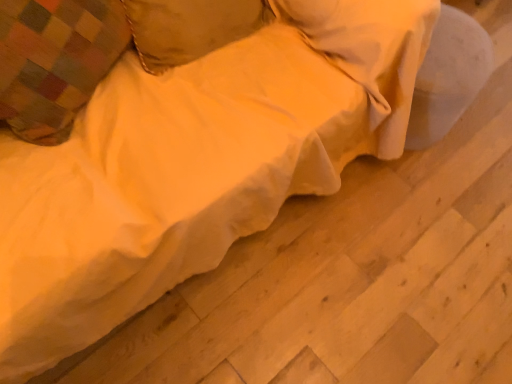
Question: Can you confirm if soft yellow fabric pillow at upper center, arranged as the first pillow when viewed from the right, is positioned to the left of plaid fabric pillow at upper left, placed as the first pillow when sorted from left to right?

Choices:
 (A) yes
 (B) no

Answer: (B)

Question: From the image's perspective, is soft yellow fabric pillow at upper center, arranged as the first pillow when viewed from the right, located beneath plaid fabric pillow at upper left, the 2th pillow when ordered from right to left?

Choices:
 (A) no
 (B) yes

Answer: (A)

Question: Considering the relative positions of soft yellow fabric pillow at upper center, the second pillow positioned from the left, and plaid fabric pillow at upper left, placed as the first pillow when sorted from left to right, in the image provided, is soft yellow fabric pillow at upper center, the second pillow positioned from the left, behind plaid fabric pillow at upper left, placed as the first pillow when sorted from left to right,?

Choices:
 (A) no
 (B) yes

Answer: (B)

Question: Can you confirm if soft yellow fabric pillow at upper center, the second pillow positioned from the left, is positioned to the right of plaid fabric pillow at upper left, placed as the first pillow when sorted from left to right?

Choices:
 (A) no
 (B) yes

Answer: (B)

Question: Can you confirm if soft yellow fabric pillow at upper center, arranged as the first pillow when viewed from the right, is smaller than plaid fabric pillow at upper left, the 2th pillow when ordered from right to left?

Choices:
 (A) no
 (B) yes

Answer: (B)

Question: Does soft yellow fabric pillow at upper center, arranged as the first pillow when viewed from the right, lie in front of plaid fabric pillow at upper left, placed as the first pillow when sorted from left to right?

Choices:
 (A) yes
 (B) no

Answer: (B)

Question: Can you confirm if plaid fabric pillow at upper left, the 2th pillow when ordered from right to left, is shorter than soft yellow fabric pillow at upper center, the second pillow positioned from the left?

Choices:
 (A) no
 (B) yes

Answer: (A)

Question: Does plaid fabric pillow at upper left, the 2th pillow when ordered from right to left, appear on the left side of soft yellow fabric pillow at upper center, the second pillow positioned from the left?

Choices:
 (A) no
 (B) yes

Answer: (B)

Question: Is plaid fabric pillow at upper left, the 2th pillow when ordered from right to left, oriented away from soft yellow fabric pillow at upper center, the second pillow positioned from the left?

Choices:
 (A) yes
 (B) no

Answer: (B)

Question: Does plaid fabric pillow at upper left, the 2th pillow when ordered from right to left, turn towards soft yellow fabric pillow at upper center, the second pillow positioned from the left?

Choices:
 (A) no
 (B) yes

Answer: (A)

Question: Considering the relative sizes of plaid fabric pillow at upper left, placed as the first pillow when sorted from left to right, and soft yellow fabric pillow at upper center, the second pillow positioned from the left, in the image provided, is plaid fabric pillow at upper left, placed as the first pillow when sorted from left to right, taller than soft yellow fabric pillow at upper center, the second pillow positioned from the left,?

Choices:
 (A) yes
 (B) no

Answer: (A)

Question: Is plaid fabric pillow at upper left, placed as the first pillow when sorted from left to right, in contact with soft yellow fabric pillow at upper center, the second pillow positioned from the left?

Choices:
 (A) yes
 (B) no

Answer: (B)

Question: From a real-world perspective, is soft yellow fabric pillow at upper center, arranged as the first pillow when viewed from the right, positioned above or below plaid fabric pillow at upper left, the 2th pillow when ordered from right to left?

Choices:
 (A) below
 (B) above

Answer: (A)